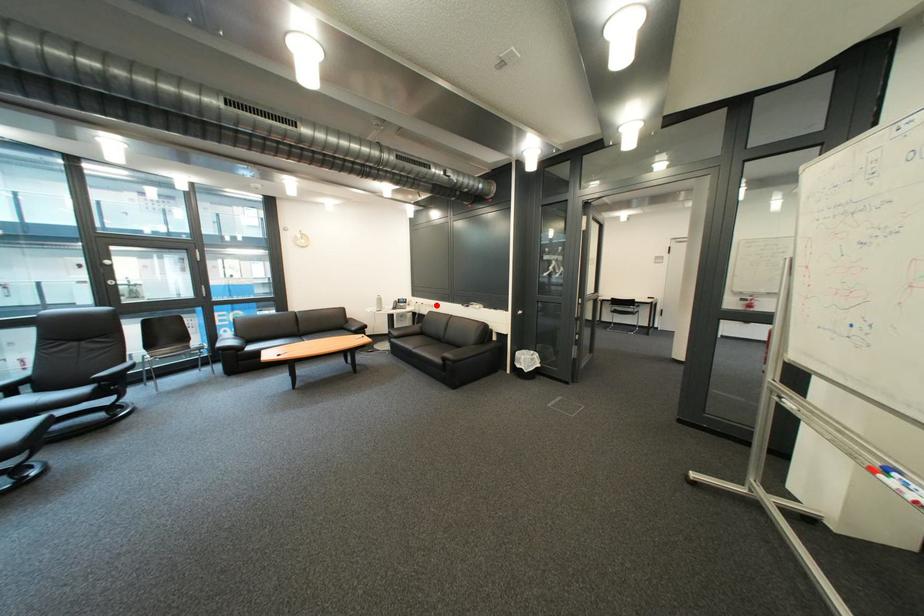
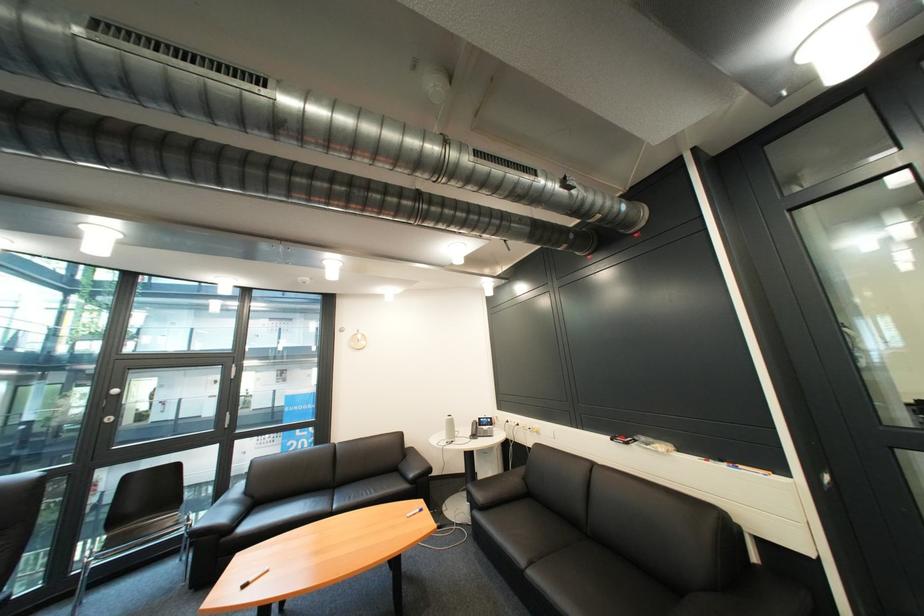
Question: I am providing you with two images of the same scene from different viewpoints. Image1 has a red point marked. In image2, the corresponding 3D location appears at what relative position? Reply with the corresponding letter.

Choices:
 (A) Closer
 (B) Farther

Answer: (B)